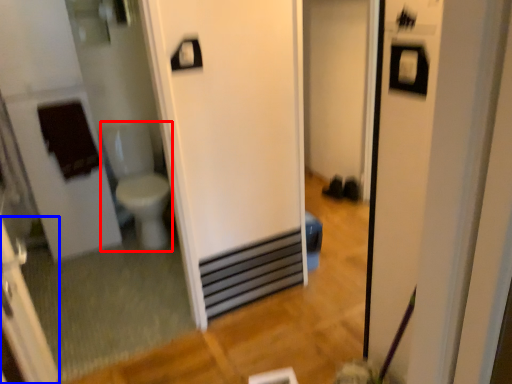
Question: Which point is closer to the camera, toilet bowl (highlighted by a red box) or screen door (highlighted by a blue box)?

Choices:
 (A) toilet bowl
 (B) screen door

Answer: (B)